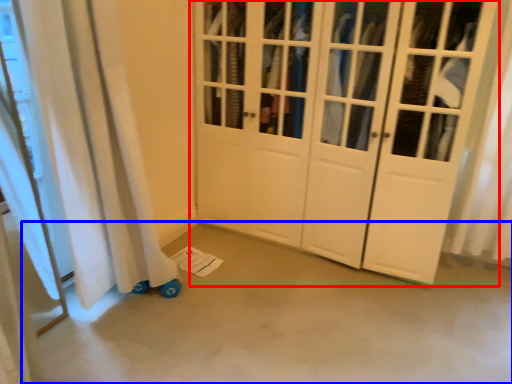
Question: Which object is closer to the camera taking this photo, door (highlighted by a red box) or concrete (highlighted by a blue box)?

Choices:
 (A) door
 (B) concrete

Answer: (B)